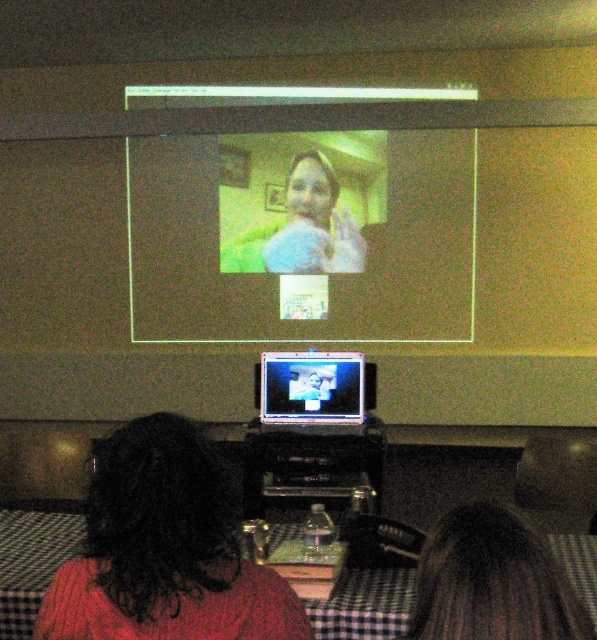
Is matte plastic screen at upper center taller than dark brown hair at lower left?

Yes.

The image size is (597, 640). What do you see at coordinates (303, 236) in the screenshot? I see `matte plastic screen at upper center` at bounding box center [303, 236].

Locate an element on the screen. The image size is (597, 640). matte plastic screen at upper center is located at coordinates (303, 236).

Between dark brown hair at lower left and shiny silver laptop at center, which one is positioned lower?

dark brown hair at lower left is lower down.

The image size is (597, 640). Describe the element at coordinates (164, 548) in the screenshot. I see `dark brown hair at lower left` at that location.

This screenshot has width=597, height=640. What are the coordinates of `dark brown hair at lower left` in the screenshot? It's located at 164,548.

Between point (250, 308) and point (297, 369), which one is positioned behind?

Positioned behind is point (250, 308).

Is matte plastic screen at upper center to the left of shiny silver laptop at center from the viewer's perspective?

Yes, matte plastic screen at upper center is to the left of shiny silver laptop at center.

Which is in front, point (309, 246) or point (278, 369)?

Point (278, 369)

The width and height of the screenshot is (597, 640). Identify the location of matte plastic screen at upper center. (303, 236).